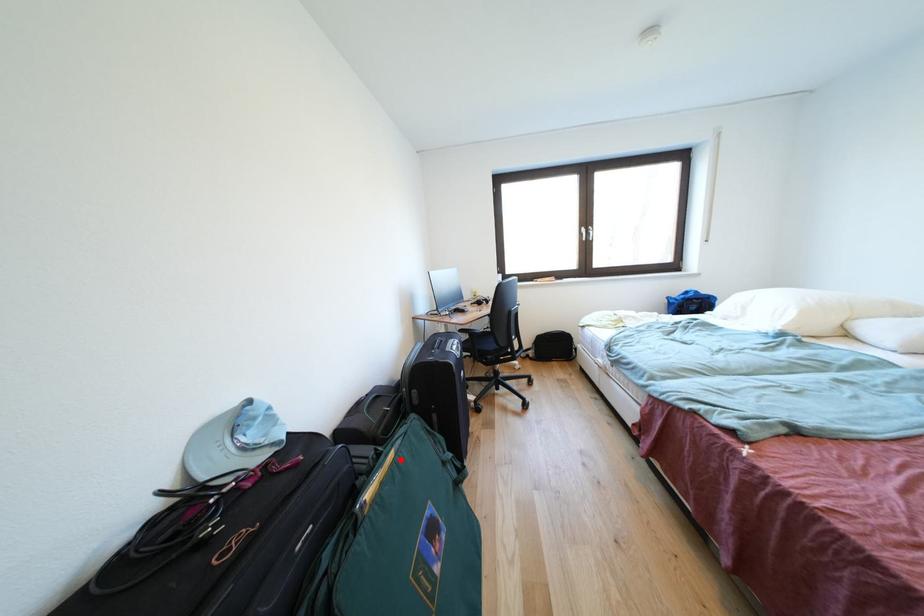
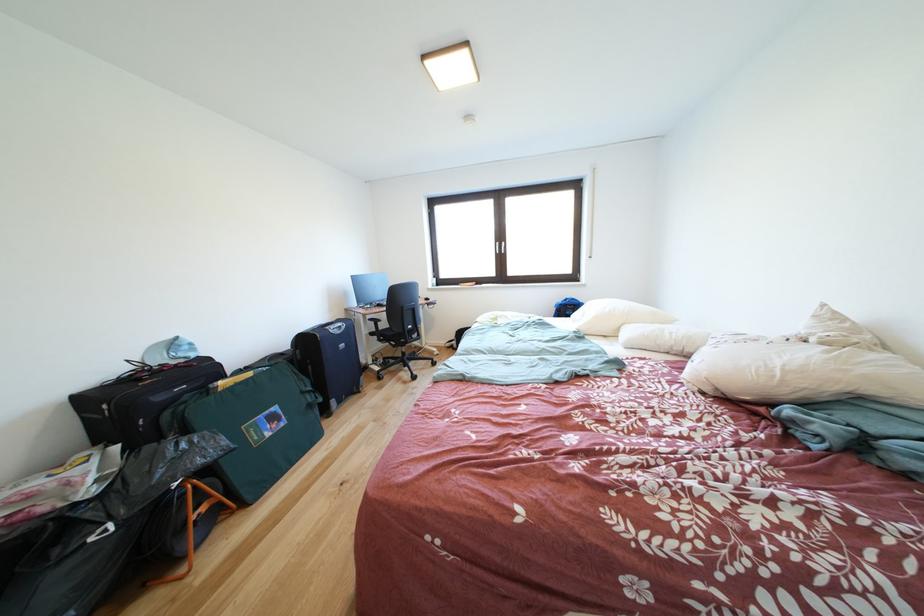
The point at the highlighted location is marked in the first image. Where is the corresponding point in the second image?

(259, 379)